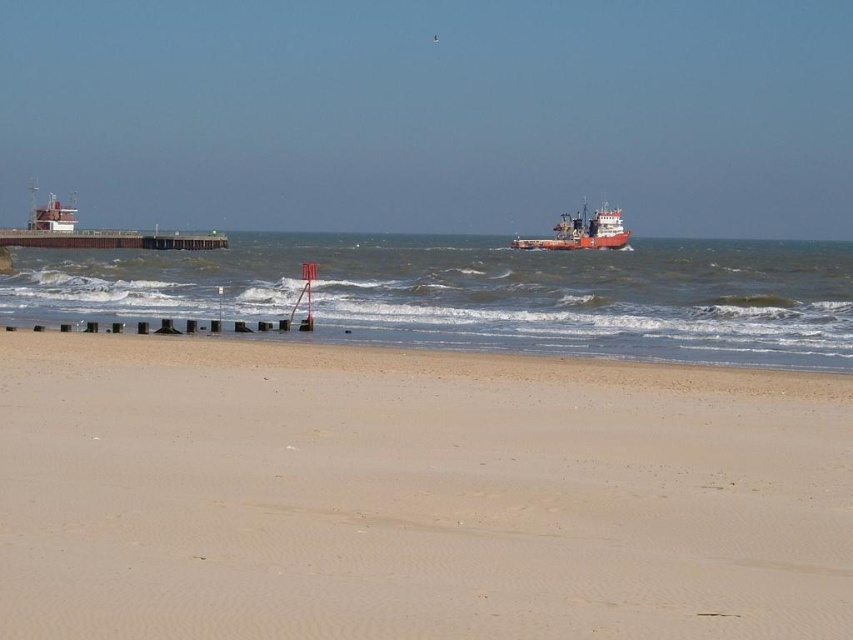
You are standing at the beach and see two points marked on the sand. The first point is at coordinates point (15,413) and the second is at point (358,339). Which point is closer to the ocean?

Point (15,413) is in front of point (358,339), so it is closer to the ocean.